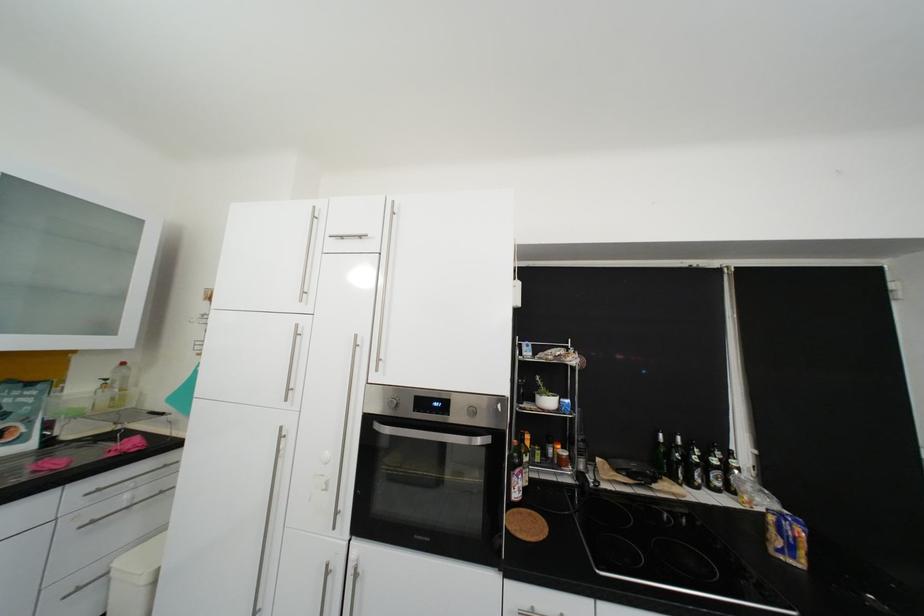
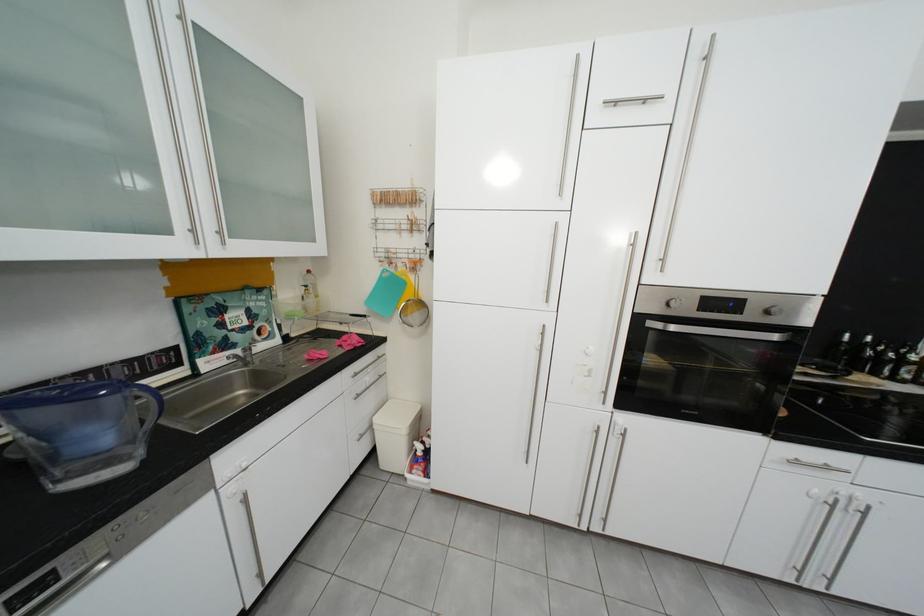
Locate, in the second image, the point that corresponds to [125,573] in the first image.

(386, 428)